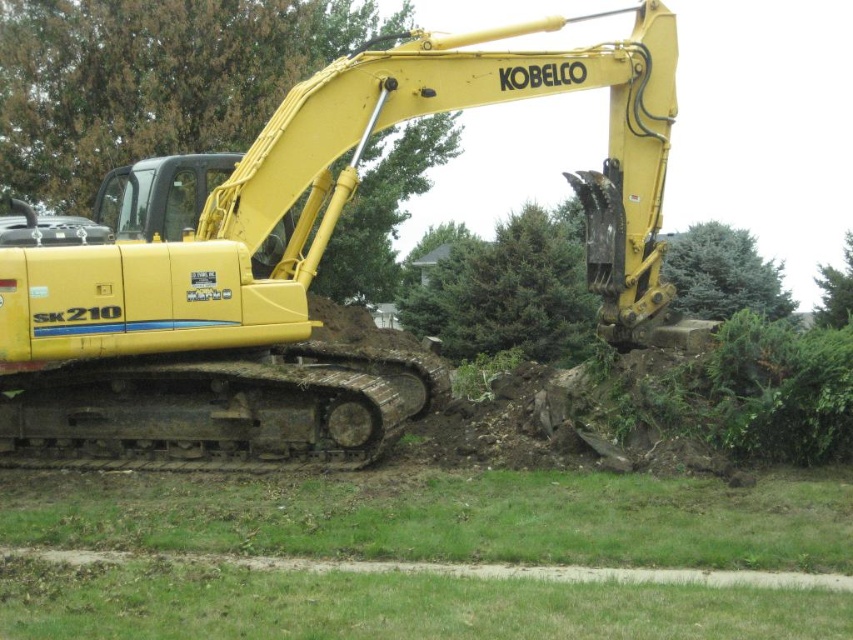
Between green textured tree at upper center and green leafy tree at upper right, which one appears on the right side from the viewer's perspective?

green leafy tree at upper right is more to the right.

Where is `green textured tree at upper center`? green textured tree at upper center is located at coordinates (723, 273).

Measure the distance from yellow rubber tractor at center to green leafy tree at upper center.

A distance of 9.81 meters exists between yellow rubber tractor at center and green leafy tree at upper center.

Between yellow rubber tractor at center and green leafy tree at upper center, which one appears on the left side from the viewer's perspective?

Positioned to the left is green leafy tree at upper center.

Does point (42, 422) lie behind point (195, 141)?

No, (42, 422) is in front of (195, 141).

This screenshot has width=853, height=640. What are the coordinates of `yellow rubber tractor at center` in the screenshot? It's located at (299, 268).

Consider the image. Who is more forward, (445, 129) or (721, 248)?

Point (445, 129)

Can you confirm if green leafy tree at upper center is positioned below green textured tree at upper center?

Actually, green leafy tree at upper center is above green textured tree at upper center.

Does point (244, 106) come closer to viewer compared to point (699, 256)?

Yes, it is.

Where is `green leafy tree at upper center`? The image size is (853, 640). green leafy tree at upper center is located at coordinates (152, 80).